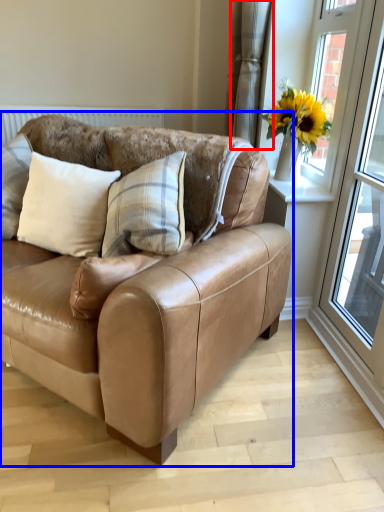
Question: Among these objects, which one is nearest to the camera, curtain (highlighted by a red box) or studio couch (highlighted by a blue box)?

Choices:
 (A) curtain
 (B) studio couch

Answer: (B)